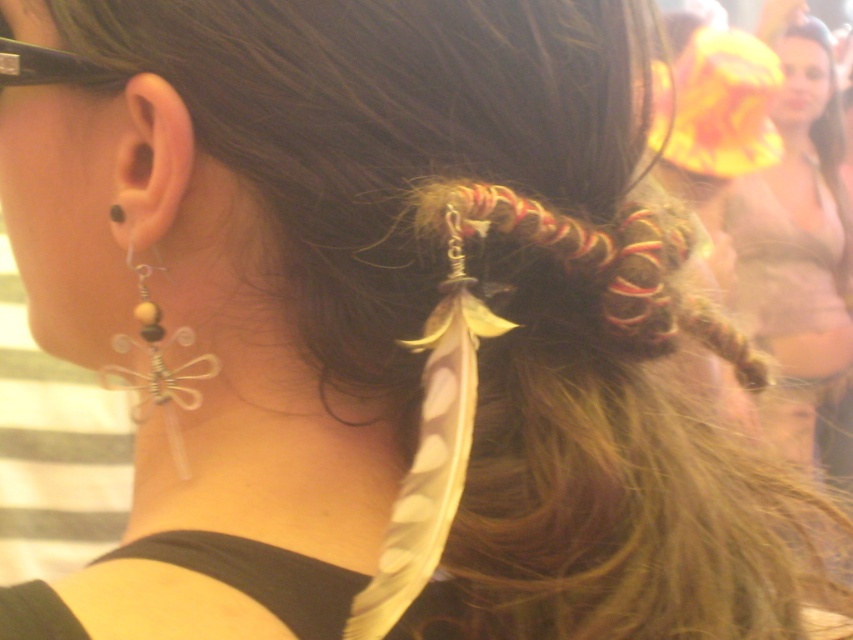
Question: Which point appears farthest from the camera in this image?

Choices:
 (A) (113, 209)
 (B) (782, 294)

Answer: (B)

Question: Does matte gold hair at upper right lie in front of clear plastic dragonfly at ear?

Choices:
 (A) no
 (B) yes

Answer: (A)

Question: Where is matte gold hair at upper right located in relation to clear plastic dragonfly at ear in the image?

Choices:
 (A) right
 (B) left

Answer: (A)

Question: Where is matte gold hair at upper right located in relation to clear plastic dragonfly at ear in the image?

Choices:
 (A) above
 (B) below

Answer: (A)

Question: Which of the following is the farthest from the observer?

Choices:
 (A) (114, 216)
 (B) (747, 225)

Answer: (B)

Question: Which point appears farthest from the camera in this image?

Choices:
 (A) 115,216
 (B) 833,308

Answer: (B)